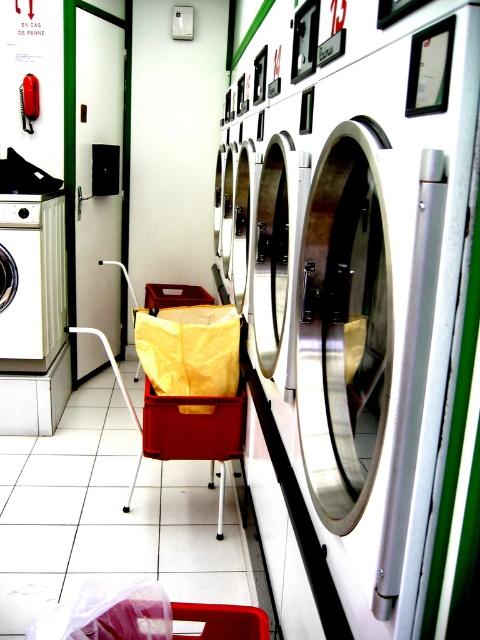
You are moving laundry items from the matte red plastic crate at center to the white glossy washing machine at center. Which object will you need to reach higher to place the laundry into?

You will need to reach higher to place laundry into the white glossy washing machine at center because it is much taller than the matte red plastic crate at center.